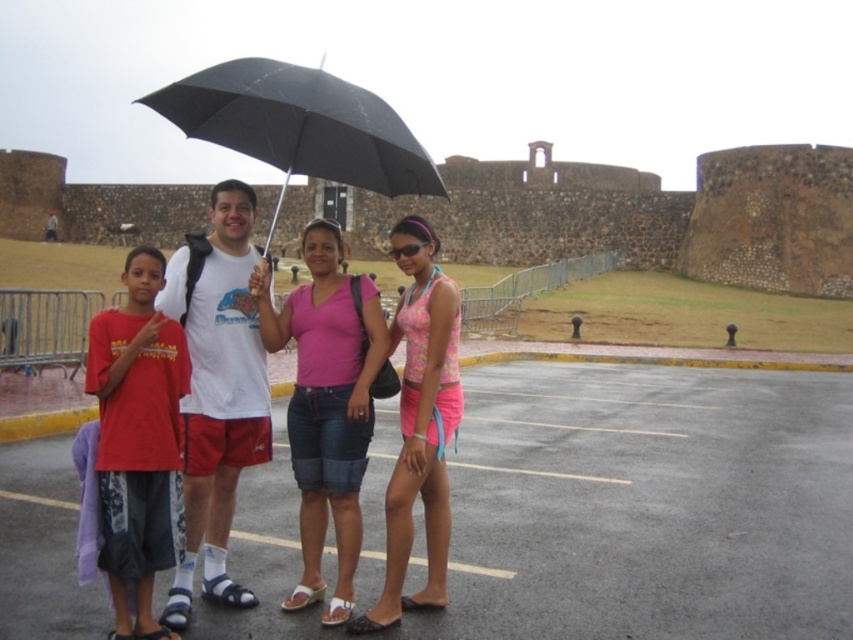
Question: Is gray asphalt parking lot at center thinner than black matte umbrella at upper center?

Choices:
 (A) no
 (B) yes

Answer: (A)

Question: Among these objects, which one is farthest from the camera?

Choices:
 (A) pink fabric shirt at center
 (B) pink fabric shorts at lower left

Answer: (A)

Question: Does white matte t-shirt at center have a lesser width compared to pink fabric shirt at center?

Choices:
 (A) no
 (B) yes

Answer: (A)

Question: Which point is farther to the camera?

Choices:
 (A) gray asphalt parking lot at center
 (B) pink fabric shorts at lower left
 (C) white matte t-shirt at center

Answer: (C)

Question: Which object is farther from the camera taking this photo?

Choices:
 (A) gray asphalt parking lot at center
 (B) pink fabric top at center
 (C) pink fabric shorts at lower left
 (D) black matte umbrella at upper center

Answer: (D)

Question: Is white matte t-shirt at center to the left of pink fabric shorts at lower left from the viewer's perspective?

Choices:
 (A) no
 (B) yes

Answer: (B)